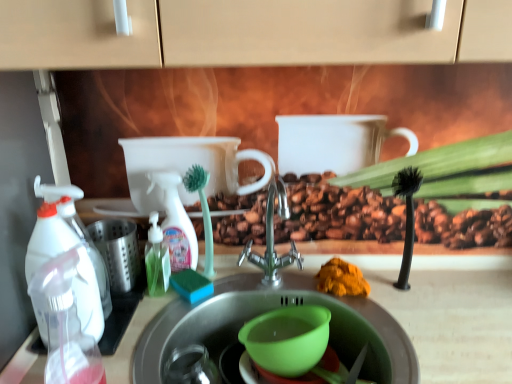
The image size is (512, 384). What do you see at coordinates (273, 238) in the screenshot? I see `satin nickel faucet at center` at bounding box center [273, 238].

The width and height of the screenshot is (512, 384). I want to click on orange powder at sink, so click(341, 279).

What do you see at coordinates (64, 251) in the screenshot? The width and height of the screenshot is (512, 384). I see `transparent plastic spray bottle at left, which is the 2th cleaning product from right to left` at bounding box center [64, 251].

Describe the element at coordinates (287, 339) in the screenshot. The image size is (512, 384). I see `green plastic mixing bowl at sink` at that location.

This screenshot has width=512, height=384. What are the coordinates of `stainless steel sink at center` in the screenshot? It's located at 272,309.

How much space does transparent plastic spray bottle at left, the second bottle viewed from the right, occupy horizontally?

4.77 inches.

Find the location of `satin nickel faucet at center`. satin nickel faucet at center is located at coordinates (273, 238).

Is translucent plastic bottle at center-left, positioned as the 2th bottle in front-to-back order, in contact with white plastic spray bottle at center, acting as the first cleaning product starting from the back?

Yes, translucent plastic bottle at center-left, positioned as the 2th bottle in front-to-back order, is with white plastic spray bottle at center, acting as the first cleaning product starting from the back.

From a real-world perspective, is translucent plastic bottle at center-left, marked as the 1th bottle in a right-to-left arrangement, over white plastic spray bottle at center, the second cleaning product positioned from the front?

Actually, translucent plastic bottle at center-left, marked as the 1th bottle in a right-to-left arrangement, is physically below white plastic spray bottle at center, the second cleaning product positioned from the front, in the real world.

What's the angular difference between translucent plastic bottle at center-left, positioned as the 2th bottle in front-to-back order, and white plastic spray bottle at center, the 1th cleaning product in the right-to-left sequence,'s facing directions?

0.00277 degrees.

Is translucent plastic bottle at center-left, positioned as the 2th bottle in front-to-back order, spatially inside white plastic spray bottle at center, acting as the first cleaning product starting from the back, or outside of it?

translucent plastic bottle at center-left, positioned as the 2th bottle in front-to-back order, is not enclosed by white plastic spray bottle at center, acting as the first cleaning product starting from the back.

Is white plastic spray bottle at center, the second cleaning product positioned from the front, not within stainless steel sink at center?

white plastic spray bottle at center, the second cleaning product positioned from the front, is positioned outside stainless steel sink at center.

Which object is positioned more to the left, white plastic spray bottle at center, the second cleaning product positioned from the front, or stainless steel sink at center?

From the viewer's perspective, white plastic spray bottle at center, the second cleaning product positioned from the front, appears more on the left side.

Does white plastic spray bottle at center, which is counted as the 2th cleaning product, starting from the left, have a lesser height compared to stainless steel sink at center?

No, white plastic spray bottle at center, which is counted as the 2th cleaning product, starting from the left, is not shorter than stainless steel sink at center.

Could you tell me if transparent plastic spray bottle at left, positioned as the 1th bottle in left-to-right order, is facing green plastic mixing bowl at sink?

No, transparent plastic spray bottle at left, positioned as the 1th bottle in left-to-right order, is not aimed at green plastic mixing bowl at sink.

From a real-world perspective, who is located higher, transparent plastic spray bottle at left, the 2th bottle from the back, or green plastic mixing bowl at sink?

In real-world perspective, transparent plastic spray bottle at left, the 2th bottle from the back, is above.

In terms of width, does transparent plastic spray bottle at left, positioned as the 1th bottle in left-to-right order, look wider or thinner when compared to green plastic mixing bowl at sink?

transparent plastic spray bottle at left, positioned as the 1th bottle in left-to-right order, is thinner than green plastic mixing bowl at sink.

From the image's perspective, is transparent plastic spray bottle at left, the 1th bottle when ordered from front to back, located above or below green plastic mixing bowl at sink?

Based on their image positions, transparent plastic spray bottle at left, the 1th bottle when ordered from front to back, is located above green plastic mixing bowl at sink.

Considering the positions of points (68, 359) and (265, 284), is point (68, 359) closer to camera compared to point (265, 284)?

That is True.

Is transparent plastic spray bottle at left, the second bottle viewed from the right, smaller than satin nickel faucet at center?

Yes, transparent plastic spray bottle at left, the second bottle viewed from the right, is smaller than satin nickel faucet at center.

Do you think transparent plastic spray bottle at left, the second bottle viewed from the right, is within satin nickel faucet at center, or outside of it?

transparent plastic spray bottle at left, the second bottle viewed from the right, is located beyond the bounds of satin nickel faucet at center.

Image resolution: width=512 pixels, height=384 pixels. Identify the location of the 1st bottle positioned below the satin nickel faucet at center (from a real-world perspective). (66, 326).

Based on the photo, from the image's perspective, is translucent plastic bottle at center-left, which appears as the 2th bottle when viewed from the left, located above or below transparent plastic spray bottle at left, which is the 2th cleaning product from right to left?

Clearly, from the image's perspective, translucent plastic bottle at center-left, which appears as the 2th bottle when viewed from the left, is below transparent plastic spray bottle at left, which is the 2th cleaning product from right to left.

Who is shorter, translucent plastic bottle at center-left, marked as the 1th bottle in a right-to-left arrangement, or transparent plastic spray bottle at left, placed as the second cleaning product when sorted from back to front?

translucent plastic bottle at center-left, marked as the 1th bottle in a right-to-left arrangement, is shorter.

Between point (147, 251) and point (86, 286), which one is positioned behind?

The point (147, 251) is farther from the camera.

Can you confirm if translucent plastic bottle at center-left, the 1th bottle when ordered from back to front, is positioned to the left of transparent plastic spray bottle at left, placed as the second cleaning product when sorted from back to front?

No, translucent plastic bottle at center-left, the 1th bottle when ordered from back to front, is not to the left of transparent plastic spray bottle at left, placed as the second cleaning product when sorted from back to front.

How many degrees apart are the facing directions of translucent plastic bottle at center-left, marked as the 1th bottle in a right-to-left arrangement, and transparent plastic spray bottle at left, the 1th bottle when ordered from front to back?

0.012 degrees.

Is translucent plastic bottle at center-left, which appears as the 2th bottle when viewed from the left, placed right next to transparent plastic spray bottle at left, the second bottle viewed from the right?

There is a gap between translucent plastic bottle at center-left, which appears as the 2th bottle when viewed from the left, and transparent plastic spray bottle at left, the second bottle viewed from the right.

Which is more to the right, translucent plastic bottle at center-left, positioned as the 2th bottle in front-to-back order, or transparent plastic spray bottle at left, positioned as the 1th bottle in left-to-right order?

translucent plastic bottle at center-left, positioned as the 2th bottle in front-to-back order, is more to the right.

From the image's perspective, who appears lower, translucent plastic bottle at center-left, which appears as the 2th bottle when viewed from the left, or transparent plastic spray bottle at left, the second bottle viewed from the right?

transparent plastic spray bottle at left, the second bottle viewed from the right, from the image's perspective.

Is transparent plastic spray bottle at left, placed as the second cleaning product when sorted from back to front, bigger than satin nickel faucet at center?

Incorrect, transparent plastic spray bottle at left, placed as the second cleaning product when sorted from back to front, is not larger than satin nickel faucet at center.

Is transparent plastic spray bottle at left, acting as the 1th cleaning product starting from the front, oriented towards satin nickel faucet at center?

No, transparent plastic spray bottle at left, acting as the 1th cleaning product starting from the front, is not facing towards satin nickel faucet at center.

Is satin nickel faucet at center inside transparent plastic spray bottle at left, acting as the first cleaning product starting from the left?

No.

Considering the positions of objects transparent plastic spray bottle at left, acting as the 1th cleaning product starting from the front, and satin nickel faucet at center in the image provided, who is more to the left, transparent plastic spray bottle at left, acting as the 1th cleaning product starting from the front, or satin nickel faucet at center?

transparent plastic spray bottle at left, acting as the 1th cleaning product starting from the front.

In order to click on the 2nd bottle positioned below the white plastic spray bottle at center, acting as the first cleaning product starting from the back (from a real-world perspective) in this screenshot , I will do `click(156, 259)`.

The image size is (512, 384). In order to click on the 1st cleaning product counting from the left of the stainless steel sink at center in this screenshot , I will do `click(175, 222)`.

Looking at the image, which one is located further to stainless steel sink at center, transparent plastic spray bottle at left, the 2th bottle from the back, or transparent plastic spray bottle at left, placed as the second cleaning product when sorted from back to front?

transparent plastic spray bottle at left, placed as the second cleaning product when sorted from back to front, is further to stainless steel sink at center.

Which object lies nearer to the anchor point translucent plastic bottle at center-left, which appears as the 2th bottle when viewed from the left, satin nickel faucet at center or orange powder at sink?

The object closer to translucent plastic bottle at center-left, which appears as the 2th bottle when viewed from the left, is satin nickel faucet at center.

Based on their spatial positions, is green plastic mixing bowl at sink or satin nickel faucet at center closer to white plastic spray bottle at center, which is counted as the 2th cleaning product, starting from the left?

satin nickel faucet at center lies closer to white plastic spray bottle at center, which is counted as the 2th cleaning product, starting from the left, than the other object.

Estimate the real-world distances between objects in this image. Which object is further from white plastic spray bottle at center, the 1th cleaning product in the right-to-left sequence, orange powder at sink or transparent plastic spray bottle at left, acting as the 1th cleaning product starting from the front?

orange powder at sink is further to white plastic spray bottle at center, the 1th cleaning product in the right-to-left sequence.

Based on their spatial positions, is stainless steel sink at center or satin nickel faucet at center further from orange powder at sink?

Among the two, stainless steel sink at center is located further to orange powder at sink.

When comparing their distances from green plastic mixing bowl at sink, does satin nickel faucet at center or transparent plastic spray bottle at left, the second bottle viewed from the right, seem closer?

satin nickel faucet at center.

Looking at the image, which one is located closer to translucent plastic bottle at center-left, marked as the 1th bottle in a right-to-left arrangement, white plastic spray bottle at center, which is counted as the 2th cleaning product, starting from the left, or orange powder at sink?

white plastic spray bottle at center, which is counted as the 2th cleaning product, starting from the left, is positioned closer to the anchor translucent plastic bottle at center-left, marked as the 1th bottle in a right-to-left arrangement.

Looking at this image, which object lies nearer to the anchor point white plastic spray bottle at center, the second cleaning product positioned from the front, orange powder at sink or transparent plastic spray bottle at left, the second bottle viewed from the right?

transparent plastic spray bottle at left, the second bottle viewed from the right, is closer to white plastic spray bottle at center, the second cleaning product positioned from the front.

Locate an element on the screen. tap situated between transparent plastic spray bottle at left, acting as the 1th cleaning product starting from the front, and stainless steel sink at center from left to right is located at coordinates (273, 238).

The height and width of the screenshot is (384, 512). Find the location of `mixing bowl between transparent plastic spray bottle at left, positioned as the 1th bottle in left-to-right order, and orange powder at sink from left to right`. mixing bowl between transparent plastic spray bottle at left, positioned as the 1th bottle in left-to-right order, and orange powder at sink from left to right is located at coordinates (287, 339).

Locate an element on the screen. The height and width of the screenshot is (384, 512). tap between transparent plastic spray bottle at left, positioned as the 1th bottle in left-to-right order, and translucent plastic bottle at center-left, marked as the 1th bottle in a right-to-left arrangement, along the z-axis is located at coordinates (273, 238).

Locate an element on the screen. This screenshot has height=384, width=512. cleaning product situated between translucent plastic bottle at center-left, which appears as the 2th bottle when viewed from the left, and satin nickel faucet at center from left to right is located at coordinates (175, 222).